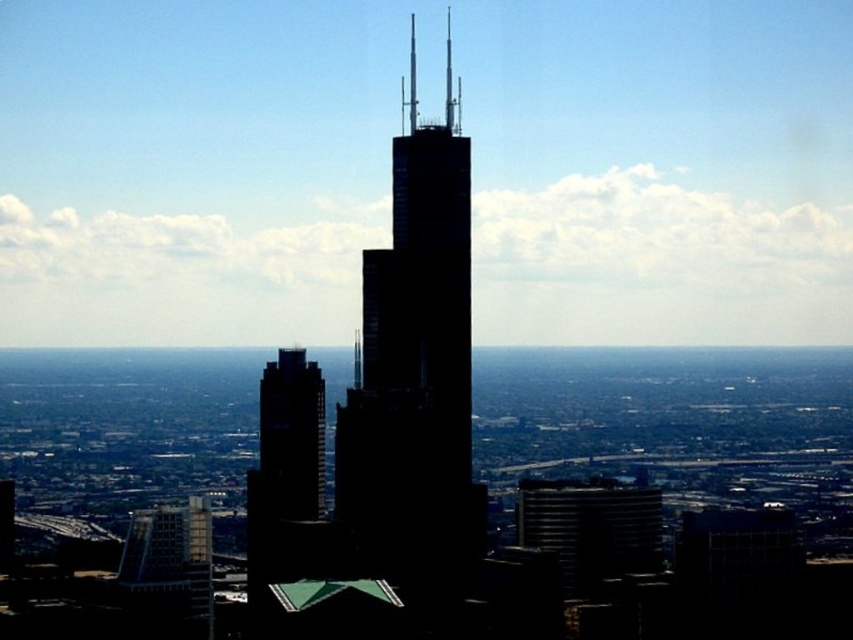
You are a drone operator planning to fly a drone between the black glass skyscraper at center and the smooth glass skyscraper at center. The drone has a minimum safe distance requirement of 30 meters between obstacles. Can you safely fly the drone between them?

The black glass skyscraper at center is 32.09 meters away from the smooth glass skyscraper at center, which exceeds the drone operator minimum safe distance requirement of 30 meters. Therefore, it is safe to fly the drone between them.

Consider the image. You are an architect observing the cityscape. You notice the black glass skyscraper at center and the smooth glass skyscraper at center. Which one appears nearer to you?

The black glass skyscraper at center is closer to the viewer than the smooth glass skyscraper at center.